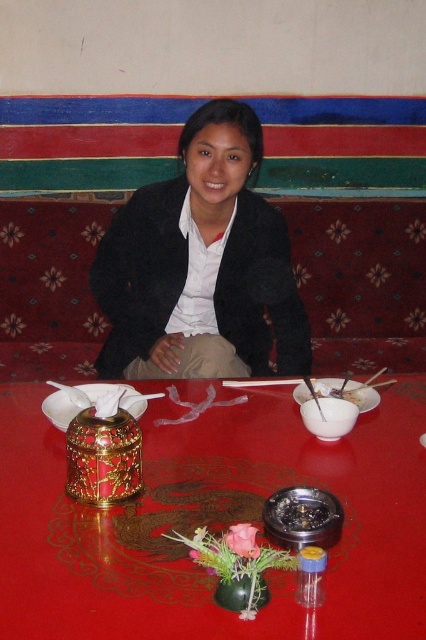
Who is higher up, black matte jacket at center or wooden chopsticks at center?

black matte jacket at center is above.

Does point (123, 348) come closer to viewer compared to point (232, 384)?

No, (123, 348) is behind (232, 384).

Identify the location of black matte jacket at center. The height and width of the screenshot is (640, 426). (201, 266).

Where is `black matte jacket at center`? The image size is (426, 640). black matte jacket at center is located at coordinates (201, 266).

Who is positioned more to the left, shiny red table at center or white matte bowl at center?

Positioned to the left is shiny red table at center.

Is point (226, 499) in front of point (351, 396)?

Yes, point (226, 499) is closer to viewer.

This screenshot has width=426, height=640. I want to click on shiny red table at center, so click(212, 522).

Does point (296, 291) come behind point (314, 381)?

Yes, it is behind point (314, 381).

The height and width of the screenshot is (640, 426). Identify the location of black matte jacket at center. (201, 266).